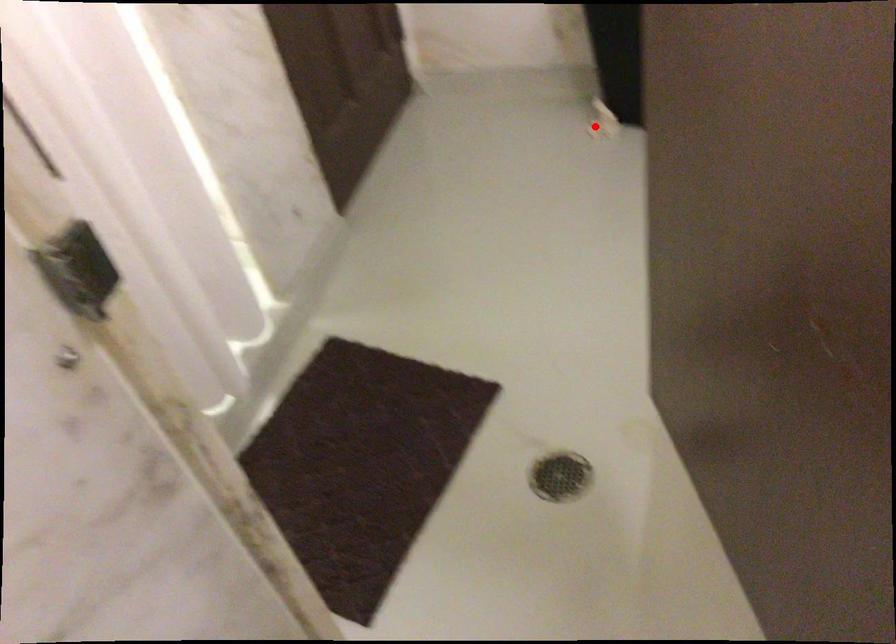
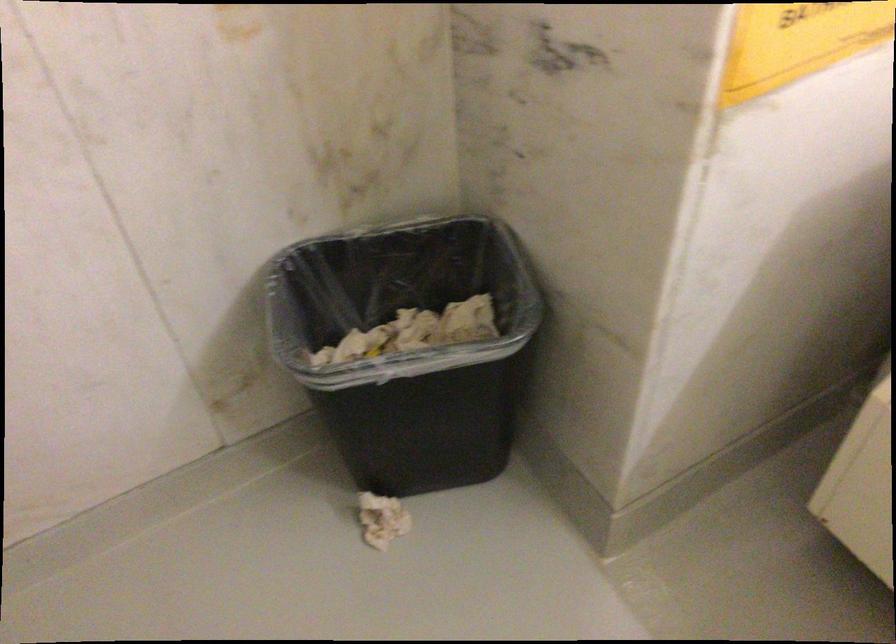
The point at the highlighted location is marked in the first image. Where is the corresponding point in the second image?

(382, 520)